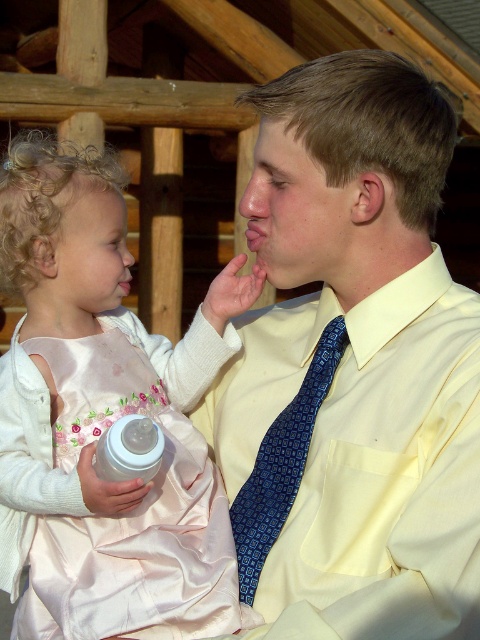
Question: Which point appears farthest from the camera in this image?

Choices:
 (A) (326, 326)
 (B) (403, 531)
 (C) (121, 442)

Answer: (A)

Question: Which of the following is the closest to the observer?

Choices:
 (A) (266, 552)
 (B) (120, 524)
 (C) (295, 236)

Answer: (A)

Question: Observing the image, what is the correct spatial positioning of pink satin dress at center in reference to white plastic bottle at lower left?

Choices:
 (A) below
 (B) above

Answer: (B)

Question: Is yellow smooth shirt at center positioned before pink satin dress at center?

Choices:
 (A) yes
 (B) no

Answer: (A)

Question: Which of these objects is positioned closest to the yellow smooth shirt at center?

Choices:
 (A) white plastic bottle at lower left
 (B) blue patterned tie at center

Answer: (B)

Question: Does yellow smooth shirt at center appear on the right side of blue patterned tie at center?

Choices:
 (A) no
 (B) yes

Answer: (B)